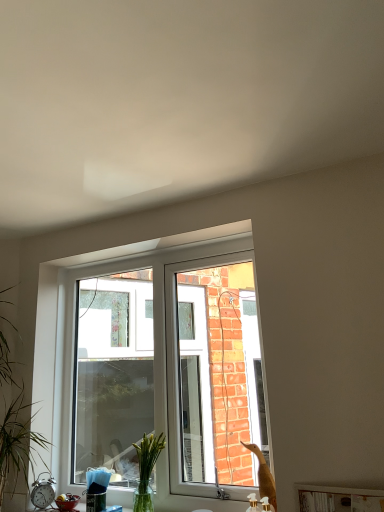
Question: From a real-world perspective, is clear glass vase at center located beneath white plastic window at center?

Choices:
 (A) yes
 (B) no

Answer: (A)

Question: Is clear glass vase at center positioned beyond the bounds of white plastic window at center?

Choices:
 (A) yes
 (B) no

Answer: (A)

Question: Is clear glass vase at center shorter than white plastic window at center?

Choices:
 (A) no
 (B) yes

Answer: (B)

Question: From a real-world perspective, is clear glass vase at center on top of white plastic window at center?

Choices:
 (A) no
 (B) yes

Answer: (A)

Question: Is clear glass vase at center far away from white plastic window at center?

Choices:
 (A) no
 (B) yes

Answer: (A)

Question: Does point (52, 490) appear closer or farther from the camera than point (326, 502)?

Choices:
 (A) farther
 (B) closer

Answer: (A)

Question: Considering the positions of silver metallic alarm clock at lower left and white glossy wood at lower center in the image, is silver metallic alarm clock at lower left wider or thinner than white glossy wood at lower center?

Choices:
 (A) thin
 (B) wide

Answer: (A)

Question: Which is correct: silver metallic alarm clock at lower left is inside white glossy wood at lower center, or outside of it?

Choices:
 (A) outside
 (B) inside

Answer: (A)

Question: Visually, is silver metallic alarm clock at lower left positioned to the left or to the right of white glossy wood at lower center?

Choices:
 (A) left
 (B) right

Answer: (A)

Question: Would you say white plastic window at center is inside or outside white glossy wood at lower center?

Choices:
 (A) inside
 (B) outside

Answer: (B)

Question: From the image's perspective, is white plastic window at center located above or below white glossy wood at lower center?

Choices:
 (A) above
 (B) below

Answer: (A)

Question: Would you say white plastic window at center is to the left or to the right of white glossy wood at lower center in the picture?

Choices:
 (A) right
 (B) left

Answer: (B)

Question: From their relative heights in the image, would you say white plastic window at center is taller or shorter than white glossy wood at lower center?

Choices:
 (A) tall
 (B) short

Answer: (A)

Question: Considering the positions of white plastic window at center and silver metallic alarm clock at lower left in the image, is white plastic window at center taller or shorter than silver metallic alarm clock at lower left?

Choices:
 (A) short
 (B) tall

Answer: (B)

Question: Is white plastic window at center inside the boundaries of silver metallic alarm clock at lower left, or outside?

Choices:
 (A) inside
 (B) outside

Answer: (B)